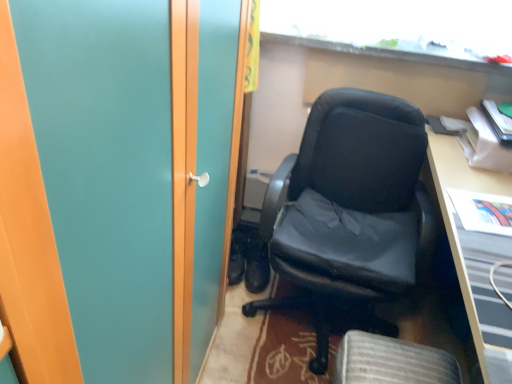
Where is `empty space that is in between black leather chair at center and black leather shoes at center, which ranks as the second footwear in left-to-right order`? This screenshot has width=512, height=384. empty space that is in between black leather chair at center and black leather shoes at center, which ranks as the second footwear in left-to-right order is located at coordinates (234, 310).